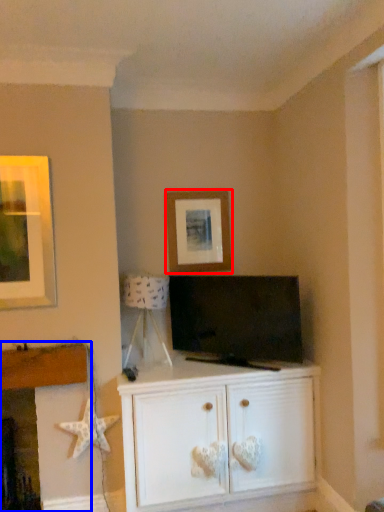
Question: Among these objects, which one is farthest to the camera, picture frame (highlighted by a red box) or fireplace (highlighted by a blue box)?

Choices:
 (A) picture frame
 (B) fireplace

Answer: (A)